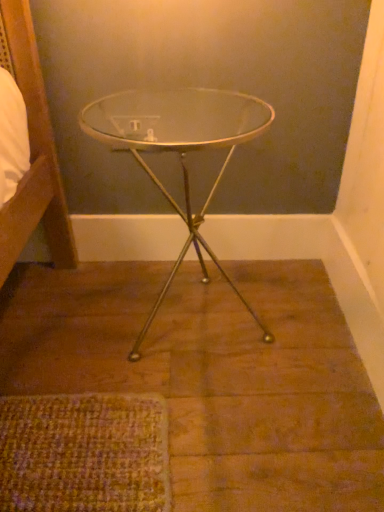
This screenshot has height=512, width=384. Describe the element at coordinates (178, 149) in the screenshot. I see `clear glass table at center` at that location.

This screenshot has width=384, height=512. Identify the location of clear glass table at center. (178, 149).

Locate an element on the screen. This screenshot has width=384, height=512. clear glass table at center is located at coordinates (178, 149).